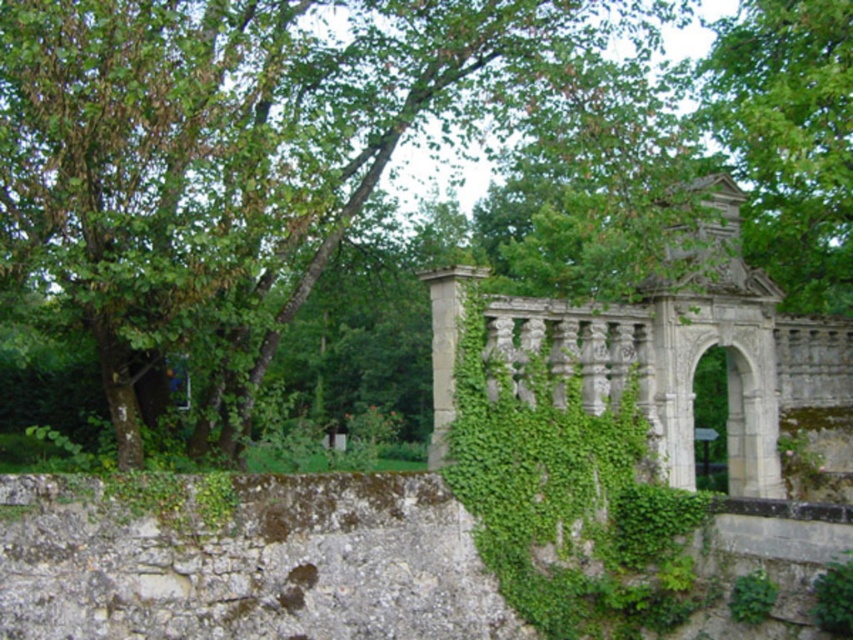
You are a landscape architect designing a pathway that must pass between the green leafy tree at upper left and the green leafy tree at upper center. Considering their widths, which tree might require more pruning to ensure the pathway is wide enough for a wheelchair? Explain your reasoning.

The green leafy tree at upper left has a greater width than the green leafy tree at upper center. Since the pathway must accommodate a wheelchair, the wider tree at upper left would likely require more pruning to ensure sufficient space.

You are standing in front of the stone archway and notice two green leafy trees in the background. Which tree, the green leafy tree at upper left or the green leafy tree at upper center, appears nearer to you?

The green leafy tree at upper left is closer to the viewer than the green leafy tree at upper center, so the green leafy tree at upper left appears nearer.